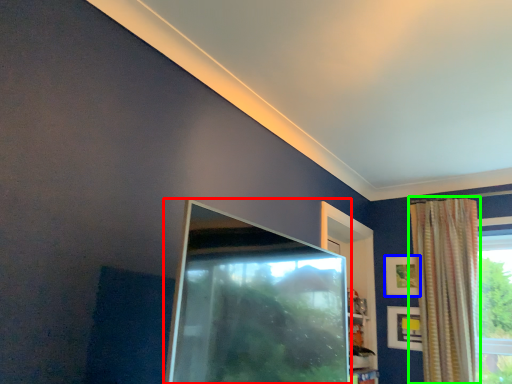
Question: Which is farther away from screen door (highlighted by a red box)? picture frame (highlighted by a blue box) or curtain (highlighted by a green box)?

Choices:
 (A) picture frame
 (B) curtain

Answer: (A)